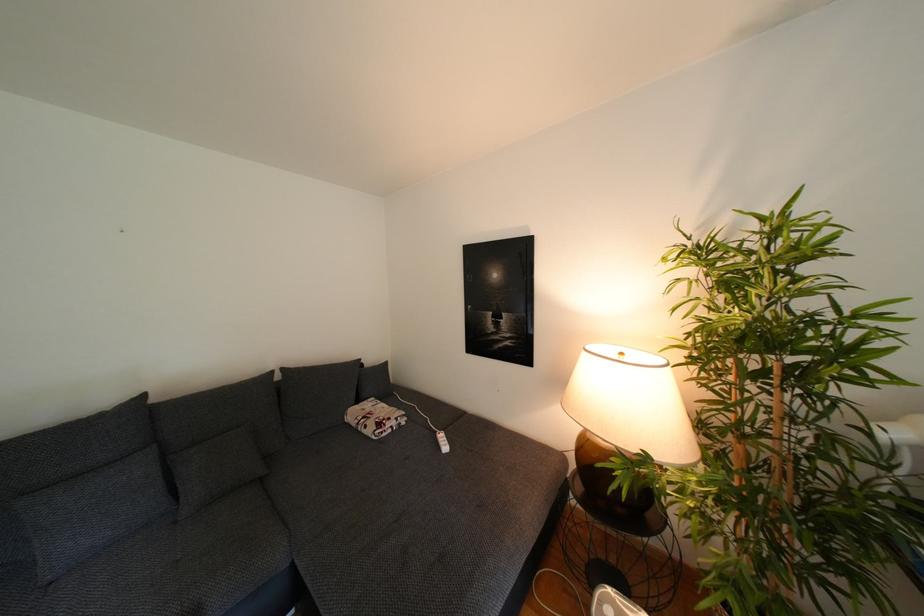
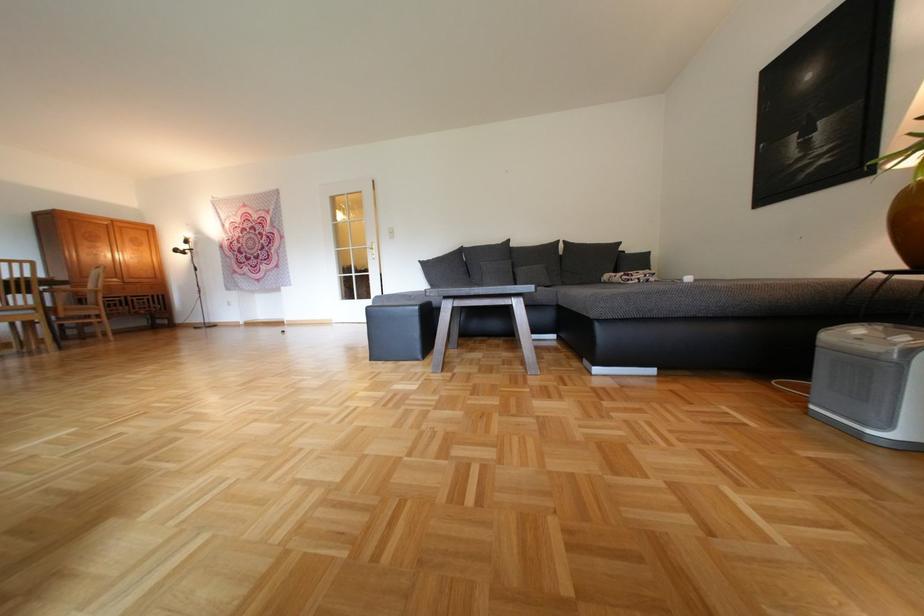
Where in the second image is the point corresponding to point 357,413 from the first image?

(614, 276)